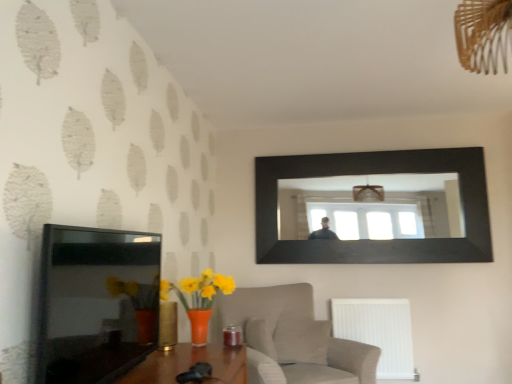
How much space does black glossy tv at left, positioned as the first picture frame in left-to-right order, occupy vertically?

black glossy tv at left, positioned as the first picture frame in left-to-right order, is 22.77 inches in height.

This screenshot has width=512, height=384. Identify the location of black glossy picture frame at upper center, which is the first picture frame in back-to-front order. (376, 173).

What do you see at coordinates (379, 332) in the screenshot? This screenshot has width=512, height=384. I see `white plastic radiator at lower right` at bounding box center [379, 332].

The width and height of the screenshot is (512, 384). Find the location of `black glossy tv at left, positioned as the first picture frame in left-to-right order`. black glossy tv at left, positioned as the first picture frame in left-to-right order is located at coordinates (93, 303).

In the scene shown: Is black glossy picture frame at upper center, which is the first picture frame in back-to-front order, oriented towards white plastic radiator at lower right?

No.

Considering the sizes of black glossy picture frame at upper center, which is counted as the 2th picture frame, starting from the front, and white plastic radiator at lower right in the image, is black glossy picture frame at upper center, which is counted as the 2th picture frame, starting from the front, wider or thinner than white plastic radiator at lower right?

In the image, black glossy picture frame at upper center, which is counted as the 2th picture frame, starting from the front, appears to be more narrow than white plastic radiator at lower right.

Who is bigger, black glossy picture frame at upper center, which is the first picture frame in back-to-front order, or white plastic radiator at lower right?

black glossy picture frame at upper center, which is the first picture frame in back-to-front order, is bigger.

Considering the positions of objects black glossy picture frame at upper center, which is counted as the 2th picture frame, starting from the front, and white plastic radiator at lower right in the image provided, who is more to the right, black glossy picture frame at upper center, which is counted as the 2th picture frame, starting from the front, or white plastic radiator at lower right?

From the viewer's perspective, black glossy picture frame at upper center, which is counted as the 2th picture frame, starting from the front, appears more on the right side.

Between white plastic radiator at lower right and black glossy tv at left, the second picture frame when ordered from back to front, which one appears on the right side from the viewer's perspective?

white plastic radiator at lower right is more to the right.

Looking at their sizes, would you say white plastic radiator at lower right is wider or thinner than black glossy tv at left, which is the 2th picture frame from right to left?

white plastic radiator at lower right is wider than black glossy tv at left, which is the 2th picture frame from right to left.

The image size is (512, 384). Identify the location of radiator below the black glossy tv at left, placed as the first picture frame when sorted from front to back (from the image's perspective). (379, 332).

From the image's perspective, which object appears higher, black glossy tv at left, the second picture frame when ordered from back to front, or white plastic radiator at lower right?

black glossy tv at left, the second picture frame when ordered from back to front, is shown above in the image.

Which object is wider, black glossy tv at left, placed as the first picture frame when sorted from front to back, or white plastic radiator at lower right?

white plastic radiator at lower right is wider.

Is point (64, 336) positioned in front of point (371, 321)?

Yes, it is in front of point (371, 321).

From a real-world perspective, who is located lower, black glossy tv at left, placed as the first picture frame when sorted from front to back, or textured beige armchair at lower center?

textured beige armchair at lower center is physically lower.

In the scene shown: From the image's perspective, relative to textured beige armchair at lower center, is black glossy tv at left, which is the 2th picture frame from right to left, above or below?

Based on their image positions, black glossy tv at left, which is the 2th picture frame from right to left, is located above textured beige armchair at lower center.

Is black glossy tv at left, positioned as the first picture frame in left-to-right order, facing towards textured beige armchair at lower center?

No, black glossy tv at left, positioned as the first picture frame in left-to-right order, is not oriented towards textured beige armchair at lower center.

Does point (406, 343) appear closer or farther from the camera than point (420, 251)?

Point (406, 343).

Is white plastic radiator at lower right positioned behind black glossy picture frame at upper center, the 1th picture frame positioned from the right?

No.

Is white plastic radiator at lower right spatially inside black glossy picture frame at upper center, the 1th picture frame positioned from the right, or outside of it?

white plastic radiator at lower right cannot be found inside black glossy picture frame at upper center, the 1th picture frame positioned from the right.

From a real-world perspective, does textured beige armchair at lower center stand above white plastic radiator at lower right?

Yes, from a real-world perspective, textured beige armchair at lower center is on top of white plastic radiator at lower right.

Is textured beige armchair at lower center turned away from white plastic radiator at lower right?

No, textured beige armchair at lower center's orientation is not away from white plastic radiator at lower right.

Looking at the image, does textured beige armchair at lower center seem bigger or smaller compared to white plastic radiator at lower right?

textured beige armchair at lower center is bigger than white plastic radiator at lower right.

Considering their positions, is textured beige armchair at lower center located in front of or behind white plastic radiator at lower right?

textured beige armchair at lower center is in front of white plastic radiator at lower right.

Between black glossy picture frame at upper center, which is the first picture frame in back-to-front order, and black glossy tv at left, positioned as the first picture frame in left-to-right order, which one has larger size?

black glossy picture frame at upper center, which is the first picture frame in back-to-front order.

Is black glossy picture frame at upper center, the 1th picture frame positioned from the right, positioned with its back to black glossy tv at left, which is the 2th picture frame from right to left?

black glossy picture frame at upper center, the 1th picture frame positioned from the right, does not have its back to black glossy tv at left, which is the 2th picture frame from right to left.

From a real-world perspective, which object rests below the other?

In real-world perspective, black glossy tv at left, which is the 2th picture frame from right to left, is lower.

Is black glossy picture frame at upper center, which is counted as the 2th picture frame, starting from the front, with black glossy tv at left, the second picture frame when ordered from back to front?

No, black glossy picture frame at upper center, which is counted as the 2th picture frame, starting from the front, is not making contact with black glossy tv at left, the second picture frame when ordered from back to front.

From the image's perspective, starting from the white plastic radiator at lower right, which picture frame is the 2nd one above? Please provide its 2D coordinates.

[(376, 173)]

Identify the location of radiator behind the black glossy tv at left, which is the 2th picture frame from right to left. (379, 332).

Which object lies nearer to the anchor point black glossy tv at left, the second picture frame when ordered from back to front, textured beige armchair at lower center or black glossy picture frame at upper center, which is the 2th picture frame in left-to-right order?

textured beige armchair at lower center is closer to black glossy tv at left, the second picture frame when ordered from back to front.

Considering their positions, is black glossy picture frame at upper center, which is the first picture frame in back-to-front order, positioned closer to white plastic radiator at lower right than textured beige armchair at lower center?

textured beige armchair at lower center is closer to white plastic radiator at lower right.

Estimate the real-world distances between objects in this image. Which object is further from textured beige armchair at lower center, white plastic radiator at lower right or black glossy tv at left, the second picture frame when ordered from back to front?

black glossy tv at left, the second picture frame when ordered from back to front, lies further to textured beige armchair at lower center than the other object.

Estimate the real-world distances between objects in this image. Which object is closer to black glossy picture frame at upper center, which is the first picture frame in back-to-front order, white plastic radiator at lower right or black glossy tv at left, positioned as the first picture frame in left-to-right order?

white plastic radiator at lower right is closer to black glossy picture frame at upper center, which is the first picture frame in back-to-front order.

From the image, which object appears to be farther from white plastic radiator at lower right, textured beige armchair at lower center or black glossy picture frame at upper center, which is counted as the 2th picture frame, starting from the front?

black glossy picture frame at upper center, which is counted as the 2th picture frame, starting from the front.

Based on their spatial positions, is black glossy tv at left, positioned as the first picture frame in left-to-right order, or black glossy picture frame at upper center, which is the 2th picture frame in left-to-right order, closer to textured beige armchair at lower center?

black glossy picture frame at upper center, which is the 2th picture frame in left-to-right order.

Based on their spatial positions, is black glossy picture frame at upper center, which is counted as the 2th picture frame, starting from the front, or white plastic radiator at lower right closer to textured beige armchair at lower center?

white plastic radiator at lower right.

Which object lies further to the anchor point white plastic radiator at lower right, black glossy tv at left, positioned as the first picture frame in left-to-right order, or textured beige armchair at lower center?

black glossy tv at left, positioned as the first picture frame in left-to-right order, is positioned further to the anchor white plastic radiator at lower right.

Identify the location of radiator between textured beige armchair at lower center and black glossy picture frame at upper center, the 1th picture frame positioned from the right, in the front-back direction. (379, 332).

The width and height of the screenshot is (512, 384). What are the coordinates of `furniture between black glossy tv at left, the second picture frame when ordered from back to front, and white plastic radiator at lower right from front to back` in the screenshot? It's located at (293, 338).

Locate an element on the screen. The height and width of the screenshot is (384, 512). radiator located between black glossy tv at left, which is the 2th picture frame from right to left, and black glossy picture frame at upper center, which is counted as the 2th picture frame, starting from the front, in the depth direction is located at coordinates (379, 332).

Where is `furniture between black glossy tv at left, the second picture frame when ordered from back to front, and black glossy picture frame at upper center, which is the 2th picture frame in left-to-right order, from front to back`? The image size is (512, 384). furniture between black glossy tv at left, the second picture frame when ordered from back to front, and black glossy picture frame at upper center, which is the 2th picture frame in left-to-right order, from front to back is located at coordinates (293, 338).